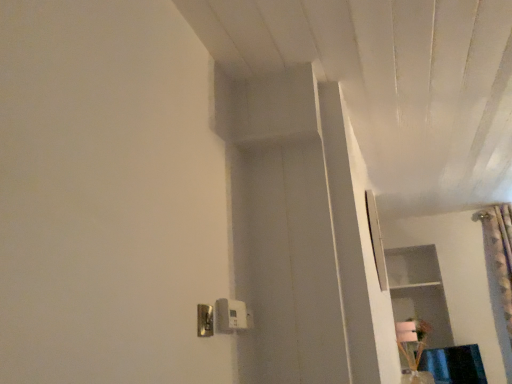
What do you see at coordinates (231, 315) in the screenshot?
I see `white plastic light switch at lower center, which is the first light switch in back-to-front order` at bounding box center [231, 315].

What is the approximate height of white plastic light switch at lower center, which is the first light switch in back-to-front order?

4.23 inches.

Measure the distance between point (x=226, y=301) and camera.

Point (x=226, y=301) is 4.63 feet from camera.

I want to click on white plastic light switch at lower center, which is the first light switch in back-to-front order, so click(x=231, y=315).

The height and width of the screenshot is (384, 512). What do you see at coordinates (205, 320) in the screenshot? I see `metallic silver light switch at lower center, marked as the first light switch in a front-to-back arrangement` at bounding box center [205, 320].

Identify the location of metallic silver light switch at lower center, which is the 2th light switch in back-to-front order. The image size is (512, 384). (205, 320).

Where is `white plastic light switch at lower center, the 2th light switch when ordered from front to back`? The height and width of the screenshot is (384, 512). white plastic light switch at lower center, the 2th light switch when ordered from front to back is located at coordinates (231, 315).

Is metallic silver light switch at lower center, which is the 2th light switch in back-to-front order, to the right of white plastic light switch at lower center, the 2th light switch when ordered from front to back, from the viewer's perspective?

No.

From the picture: Considering the positions of objects metallic silver light switch at lower center, marked as the first light switch in a front-to-back arrangement, and white plastic light switch at lower center, which is the first light switch in back-to-front order, in the image provided, who is behind, metallic silver light switch at lower center, marked as the first light switch in a front-to-back arrangement, or white plastic light switch at lower center, which is the first light switch in back-to-front order,?

white plastic light switch at lower center, which is the first light switch in back-to-front order, is further from the camera.

Does point (199, 321) come behind point (232, 309)?

No.

From the image's perspective, is metallic silver light switch at lower center, which is the 2th light switch in back-to-front order, on top of white plastic light switch at lower center, the 2th light switch when ordered from front to back?

Correct, metallic silver light switch at lower center, which is the 2th light switch in back-to-front order, appears higher than white plastic light switch at lower center, the 2th light switch when ordered from front to back, in the image.

From a real-world perspective, is metallic silver light switch at lower center, which is the 2th light switch in back-to-front order, located beneath white plastic light switch at lower center, the 2th light switch when ordered from front to back?

Yes, from a real-world perspective, metallic silver light switch at lower center, which is the 2th light switch in back-to-front order, is below white plastic light switch at lower center, the 2th light switch when ordered from front to back.

In the scene shown: Between metallic silver light switch at lower center, which is the 2th light switch in back-to-front order, and white plastic light switch at lower center, the 2th light switch when ordered from front to back, which one has smaller width?

With smaller width is metallic silver light switch at lower center, which is the 2th light switch in back-to-front order.

Considering the sizes of objects metallic silver light switch at lower center, marked as the first light switch in a front-to-back arrangement, and white plastic light switch at lower center, which is the first light switch in back-to-front order, in the image provided, who is taller, metallic silver light switch at lower center, marked as the first light switch in a front-to-back arrangement, or white plastic light switch at lower center, which is the first light switch in back-to-front order,?

white plastic light switch at lower center, which is the first light switch in back-to-front order, is taller.

Which of these two, metallic silver light switch at lower center, which is the 2th light switch in back-to-front order, or white plastic light switch at lower center, the 2th light switch when ordered from front to back, is smaller?

metallic silver light switch at lower center, which is the 2th light switch in back-to-front order, is smaller.

Would you say metallic silver light switch at lower center, which is the 2th light switch in back-to-front order, contains white plastic light switch at lower center, which is the first light switch in back-to-front order?

No, white plastic light switch at lower center, which is the first light switch in back-to-front order, is not inside metallic silver light switch at lower center, which is the 2th light switch in back-to-front order.

Is the surface of metallic silver light switch at lower center, which is the 2th light switch in back-to-front order, in direct contact with white plastic light switch at lower center, which is the first light switch in back-to-front order?

Yes, metallic silver light switch at lower center, which is the 2th light switch in back-to-front order, is right next to white plastic light switch at lower center, which is the first light switch in back-to-front order, and making contact.

Is metallic silver light switch at lower center, which is the 2th light switch in back-to-front order, looking in the opposite direction of white plastic light switch at lower center, the 2th light switch when ordered from front to back?

No, metallic silver light switch at lower center, which is the 2th light switch in back-to-front order, is not facing away from white plastic light switch at lower center, the 2th light switch when ordered from front to back.

The width and height of the screenshot is (512, 384). Find the location of `light switch below the white plastic light switch at lower center, which is the first light switch in back-to-front order (from a real-world perspective)`. light switch below the white plastic light switch at lower center, which is the first light switch in back-to-front order (from a real-world perspective) is located at coordinates (205, 320).

Which is more to the right, white plastic light switch at lower center, the 2th light switch when ordered from front to back, or metallic silver light switch at lower center, which is the 2th light switch in back-to-front order?

From the viewer's perspective, white plastic light switch at lower center, the 2th light switch when ordered from front to back, appears more on the right side.

In the scene shown: Between white plastic light switch at lower center, the 2th light switch when ordered from front to back, and metallic silver light switch at lower center, marked as the first light switch in a front-to-back arrangement, which one is positioned behind?

Positioned behind is white plastic light switch at lower center, the 2th light switch when ordered from front to back.

Which point is more forward, [239,317] or [205,315]?

The point [205,315] is in front.

Consider the image. From the image's perspective, who appears lower, white plastic light switch at lower center, which is the first light switch in back-to-front order, or metallic silver light switch at lower center, marked as the first light switch in a front-to-back arrangement?

white plastic light switch at lower center, which is the first light switch in back-to-front order, appears lower in the image.

From a real-world perspective, which object stands above the other?

white plastic light switch at lower center, which is the first light switch in back-to-front order, from a real-world perspective.

From the picture: Is white plastic light switch at lower center, the 2th light switch when ordered from front to back, wider or thinner than metallic silver light switch at lower center, which is the 2th light switch in back-to-front order?

white plastic light switch at lower center, the 2th light switch when ordered from front to back, is wider than metallic silver light switch at lower center, which is the 2th light switch in back-to-front order.

From their relative heights in the image, would you say white plastic light switch at lower center, which is the first light switch in back-to-front order, is taller or shorter than metallic silver light switch at lower center, marked as the first light switch in a front-to-back arrangement?

Considering their sizes, white plastic light switch at lower center, which is the first light switch in back-to-front order, has more height than metallic silver light switch at lower center, marked as the first light switch in a front-to-back arrangement.

Is white plastic light switch at lower center, the 2th light switch when ordered from front to back, smaller than metallic silver light switch at lower center, marked as the first light switch in a front-to-back arrangement?

No, white plastic light switch at lower center, the 2th light switch when ordered from front to back, is not smaller than metallic silver light switch at lower center, marked as the first light switch in a front-to-back arrangement.

Is white plastic light switch at lower center, which is the first light switch in back-to-front order, spatially inside metallic silver light switch at lower center, marked as the first light switch in a front-to-back arrangement, or outside of it?

white plastic light switch at lower center, which is the first light switch in back-to-front order, is spatially situated outside metallic silver light switch at lower center, marked as the first light switch in a front-to-back arrangement.

Is white plastic light switch at lower center, the 2th light switch when ordered from front to back, with metallic silver light switch at lower center, which is the 2th light switch in back-to-front order?

Yes, white plastic light switch at lower center, the 2th light switch when ordered from front to back, and metallic silver light switch at lower center, which is the 2th light switch in back-to-front order, clearly make contact.

Is white plastic light switch at lower center, the 2th light switch when ordered from front to back, looking in the opposite direction of metallic silver light switch at lower center, marked as the first light switch in a front-to-back arrangement?

white plastic light switch at lower center, the 2th light switch when ordered from front to back, is not turned away from metallic silver light switch at lower center, marked as the first light switch in a front-to-back arrangement.

What's the angular difference between white plastic light switch at lower center, which is the first light switch in back-to-front order, and metallic silver light switch at lower center, which is the 2th light switch in back-to-front order,'s facing directions?

The angle between the facing direction of white plastic light switch at lower center, which is the first light switch in back-to-front order, and the facing direction of metallic silver light switch at lower center, which is the 2th light switch in back-to-front order, is 0.0211 degrees.

Where is `light switch behind the metallic silver light switch at lower center, which is the 2th light switch in back-to-front order`? Image resolution: width=512 pixels, height=384 pixels. light switch behind the metallic silver light switch at lower center, which is the 2th light switch in back-to-front order is located at coordinates (231, 315).

This screenshot has height=384, width=512. Identify the location of light switch located behind the metallic silver light switch at lower center, which is the 2th light switch in back-to-front order. (231, 315).

The width and height of the screenshot is (512, 384). In order to click on light switch below the metallic silver light switch at lower center, which is the 2th light switch in back-to-front order (from the image's perspective) in this screenshot , I will do `click(231, 315)`.